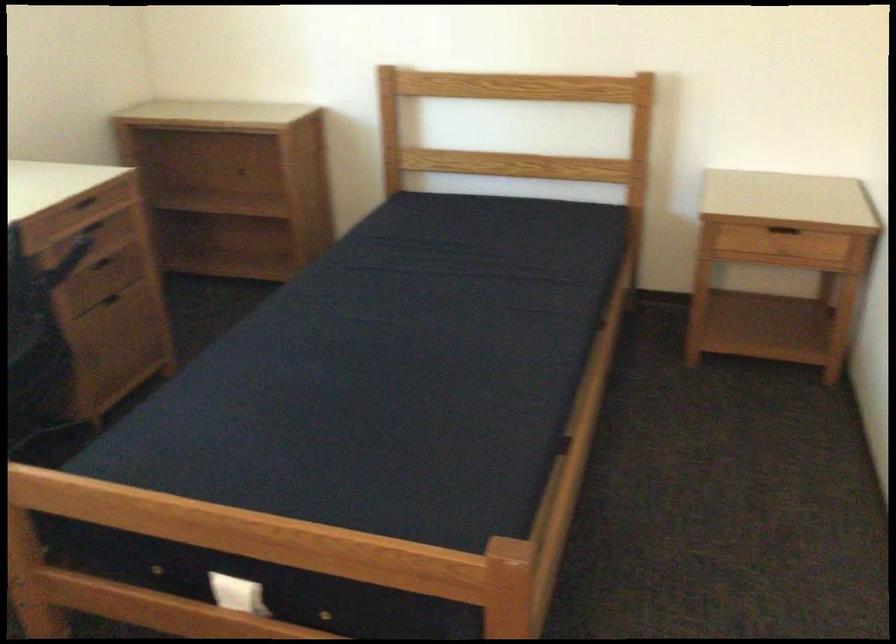
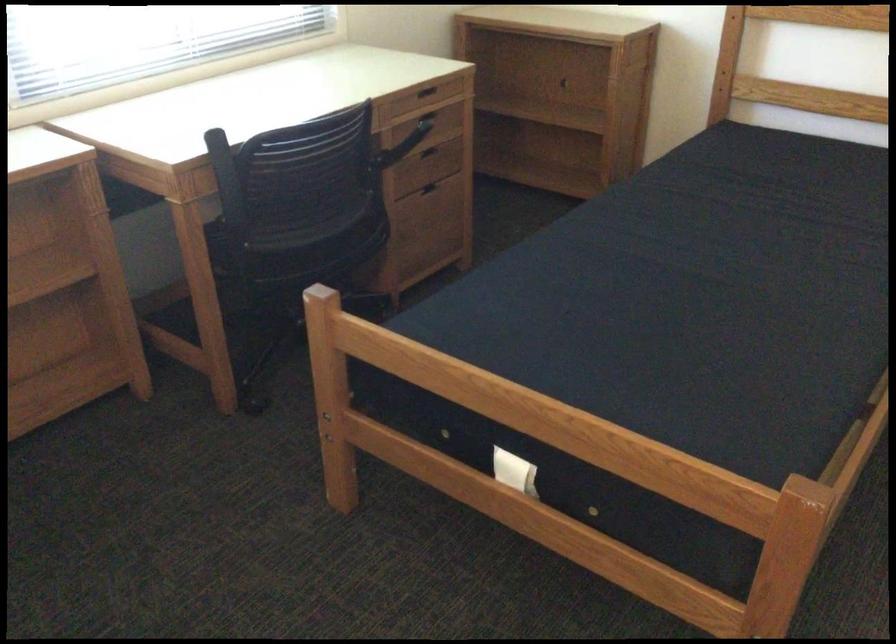
Question: In a continuous first-person perspective shot, in which direction is the camera moving?

Choices:
 (A) Left
 (B) Right
 (C) Forward
 (D) Backward

Answer: (A)